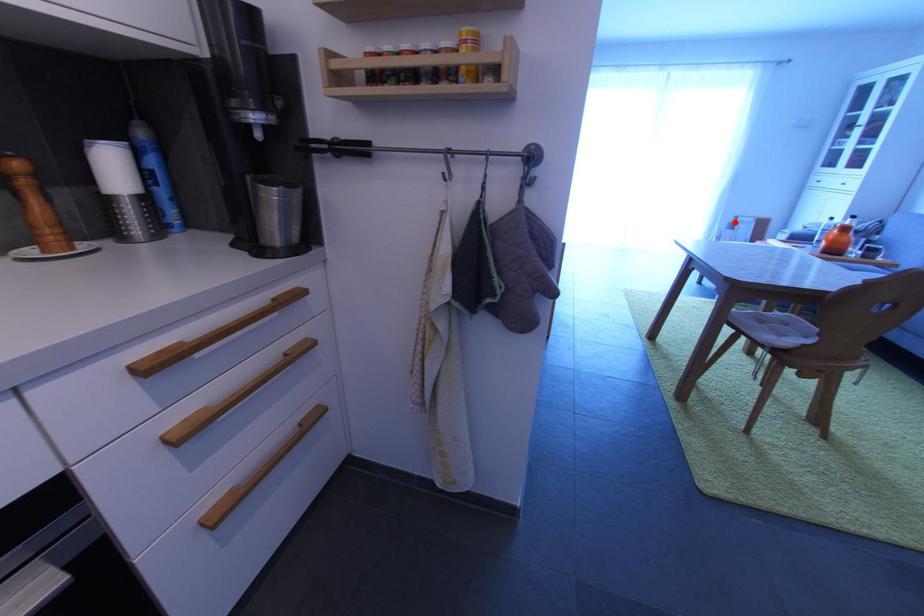
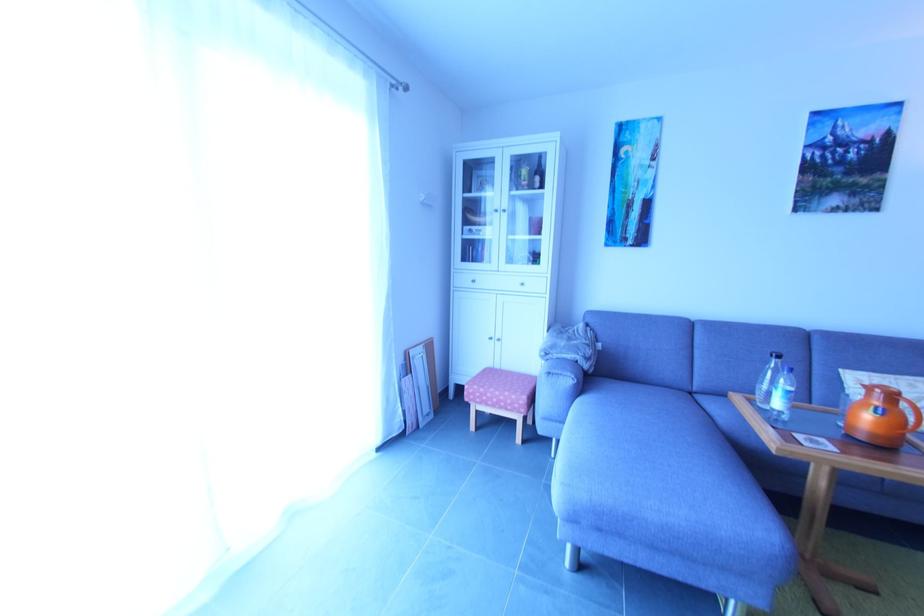
The point at the highlighted location is marked in the first image. Where is the corresponding point in the second image?

(406, 362)